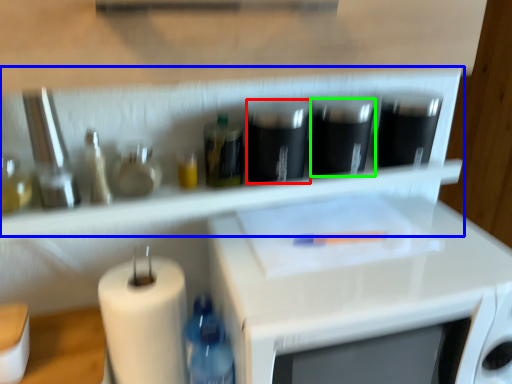
Question: Considering the real-world distances, which object is closest to appliance (highlighted by a red box)? shelf (highlighted by a blue box) or appliance (highlighted by a green box).

Choices:
 (A) shelf
 (B) appliance

Answer: (B)